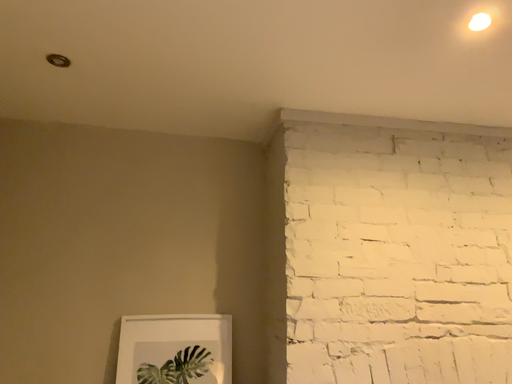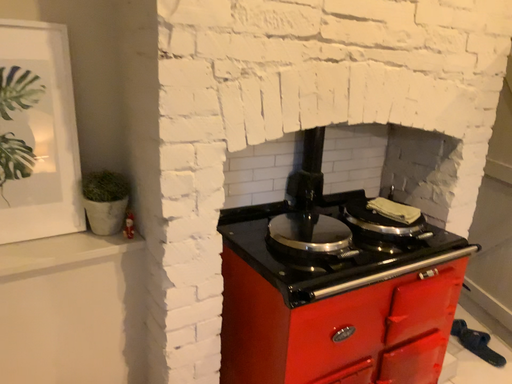
Question: How did the camera likely rotate when shooting the video?

Choices:
 (A) rotated right
 (B) rotated left

Answer: (A)